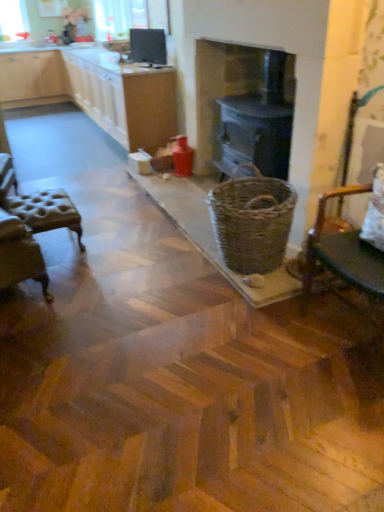
Question: From a real-world perspective, is tufted leather stool at left, which ranks as the 1th chair in left-to-right order, above or below white wood cabinets at upper left, which appears as the 1th cabinetry when viewed from the front?

Choices:
 (A) below
 (B) above

Answer: (A)

Question: Considering the positions of tufted leather stool at left, which ranks as the 1th chair in left-to-right order, and white wood cabinets at upper left, the 2th cabinetry positioned from the back, in the image, is tufted leather stool at left, which ranks as the 1th chair in left-to-right order, wider or thinner than white wood cabinets at upper left, the 2th cabinetry positioned from the back,?

Choices:
 (A) wide
 (B) thin

Answer: (B)

Question: Which of these objects is positioned closest to the dark gray wood stove at center?

Choices:
 (A) woven brown basket at center
 (B) wooden chair at right, the first chair when ordered from right to left
 (C) tufted leather stool at left, arranged as the second chair when viewed from the right
 (D) light wood cabinetry at upper left, placed as the second cabinetry when sorted from front to back
 (E) transparent plastic window screen at upper left

Answer: (A)

Question: Considering the real-world distances, which object is closest to the dark gray wood stove at center?

Choices:
 (A) wooden chair at right, placed as the 1th chair when sorted from front to back
 (B) woven brown basket at center
 (C) matte black monitor at upper center
 (D) white wood cabinets at upper left, the 2th cabinetry positioned from the back
 (E) tufted leather stool at left, placed as the second chair when sorted from front to back

Answer: (B)